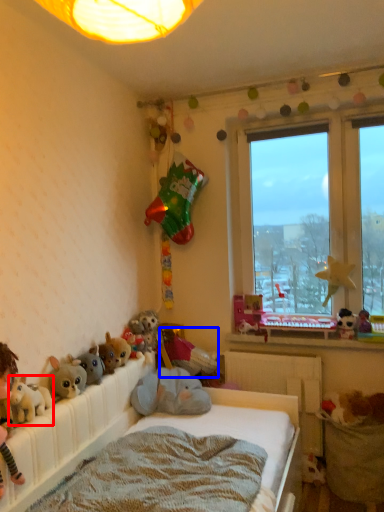
Question: Which object is closer to the camera taking this photo, toy (highlighted by a red box) or toy (highlighted by a blue box)?

Choices:
 (A) toy
 (B) toy

Answer: (A)